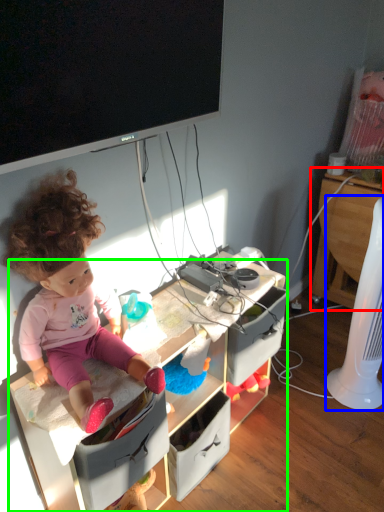
Question: Which is farther away from computer desk (highlighted by a red box)? fan (highlighted by a blue box) or desk (highlighted by a green box)?

Choices:
 (A) fan
 (B) desk

Answer: (B)